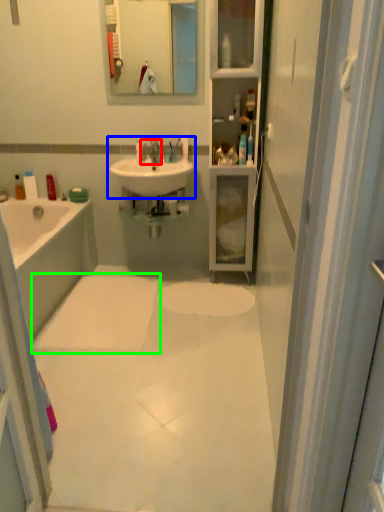
Question: Based on their relative distances, which object is nearer to tap (highlighted by a red box)? Choose from sink (highlighted by a blue box) and bath mat (highlighted by a green box).

Choices:
 (A) sink
 (B) bath mat

Answer: (A)